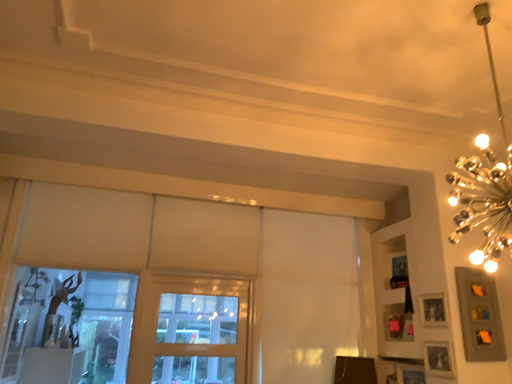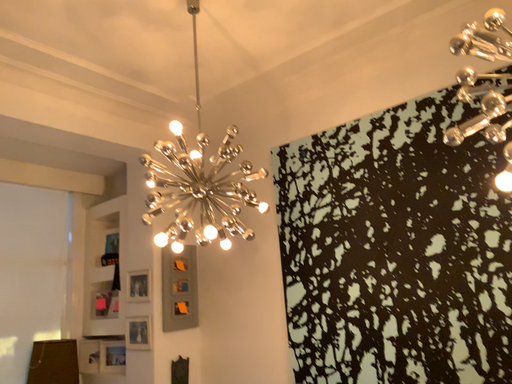
Question: Which way did the camera rotate in the video?

Choices:
 (A) rotated right
 (B) rotated left

Answer: (A)